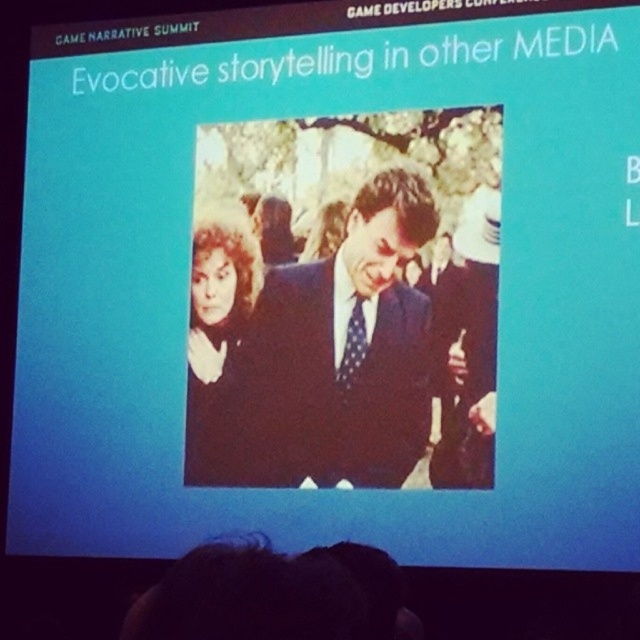
From the picture: What is the location of the point with coordinates (344, 352) in the image?

The point with coordinates (344, 352) is located on the dark blue suit at center.